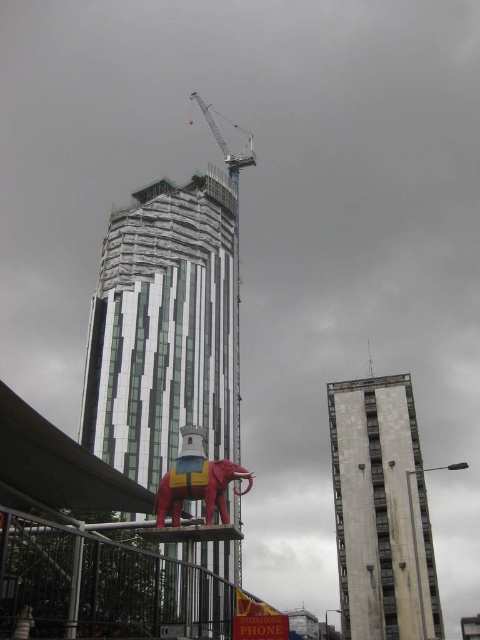
Can you confirm if white glass tower at center is taller than shiny red elephant at center?

Indeed, white glass tower at center has a greater height compared to shiny red elephant at center.

Does white glass tower at center have a greater width compared to shiny red elephant at center?

Yes.

Locate an element on the screen. white glass tower at center is located at coordinates (164, 328).

Can you confirm if white marble building at center is wider than shiny red elephant at center?

Yes, white marble building at center is wider than shiny red elephant at center.

Can you confirm if white marble building at center is positioned below shiny red elephant at center?

Correct, white marble building at center is located below shiny red elephant at center.

The height and width of the screenshot is (640, 480). What do you see at coordinates (380, 509) in the screenshot?
I see `white marble building at center` at bounding box center [380, 509].

The image size is (480, 640). In order to click on white marble building at center in this screenshot , I will do `click(380, 509)`.

Is white glass tower at center positioned at the back of white marble building at center?

No, it is in front of white marble building at center.

Between white glass tower at center and white marble building at center, which one has more height?

Standing taller between the two is white glass tower at center.

Find the location of `white glass tower at center`. white glass tower at center is located at coordinates (164, 328).